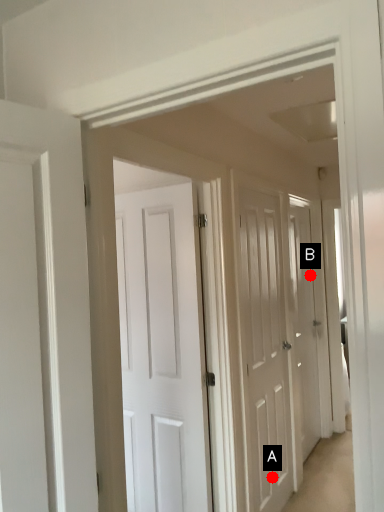
Question: Two points are circled on the image, labeled by A and B beside each circle. Which point appears farthest from the camera in this image?

Choices:
 (A) A is further
 (B) B is further

Answer: (B)